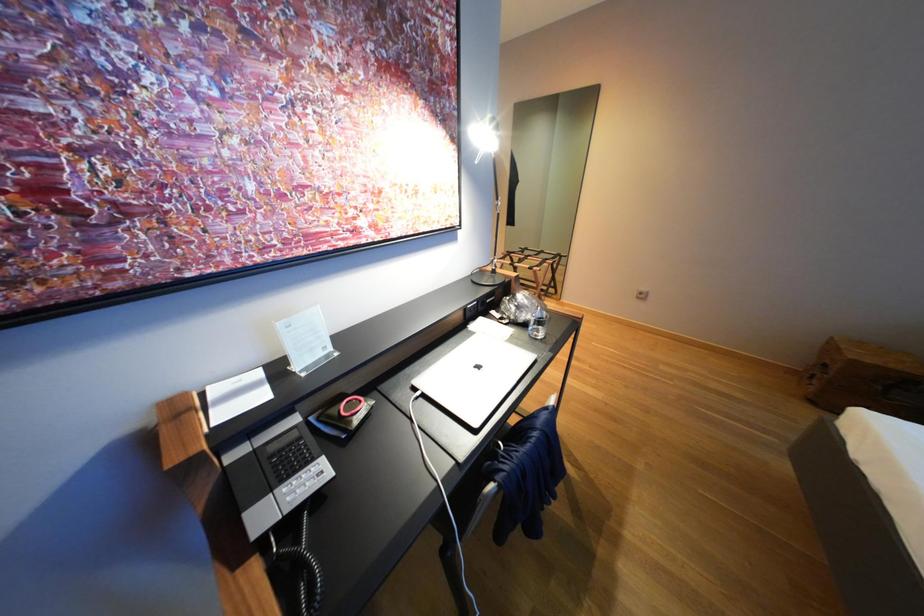
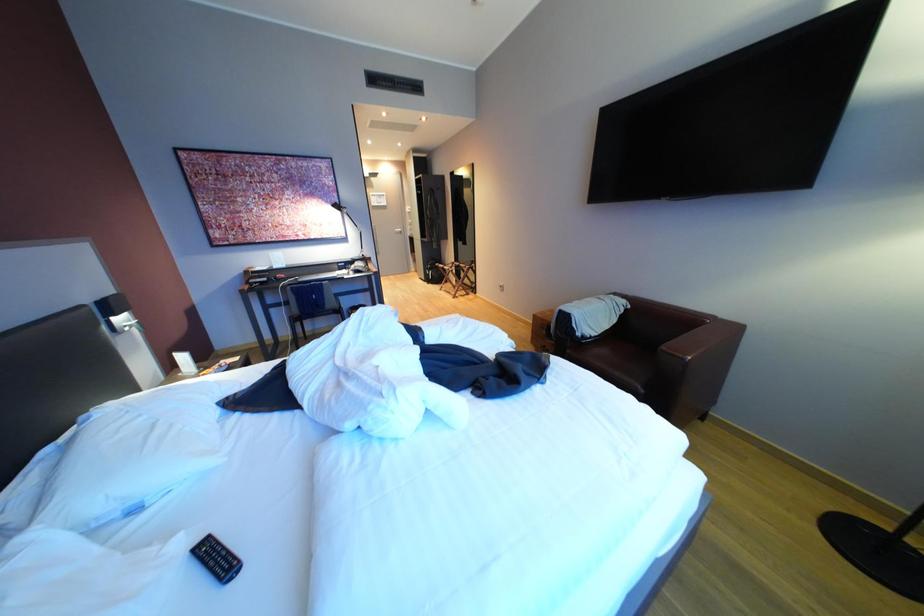
The images are taken continuously from a first-person perspective. In which direction are you moving?

The cameraman walked toward right, backward.